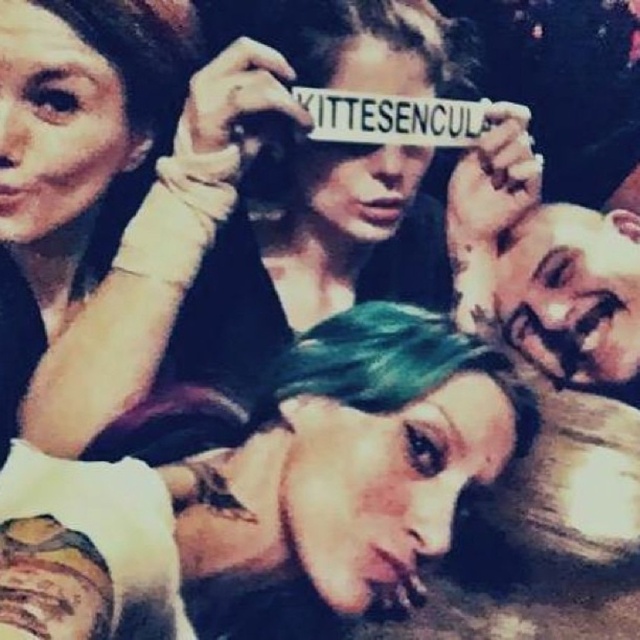
Question: Does matte black hair at upper left have a lesser width compared to green hair at lower right?

Choices:
 (A) no
 (B) yes

Answer: (A)

Question: Is matte black hair at upper left to the left of green hair at lower right from the viewer's perspective?

Choices:
 (A) yes
 (B) no

Answer: (A)

Question: Which of the following is the closest to the observer?

Choices:
 (A) teal hair at center
 (B) matte black hair at upper left
 (C) green hair at lower right

Answer: (A)

Question: Which object is positioned farthest from the matte black hair at upper left?

Choices:
 (A) green hair at lower right
 (B) teal hair at center

Answer: (A)

Question: Does matte black hair at upper left have a smaller size compared to green hair at lower right?

Choices:
 (A) no
 (B) yes

Answer: (A)

Question: Among these objects, which one is nearest to the camera?

Choices:
 (A) teal hair at center
 (B) matte black hair at upper left
 (C) green hair at lower right

Answer: (A)